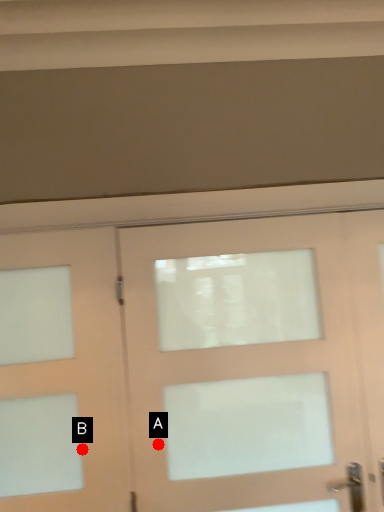
Question: Two points are circled on the image, labeled by A and B beside each circle. Which point is farther from the camera taking this photo?

Choices:
 (A) A is further
 (B) B is further

Answer: (A)